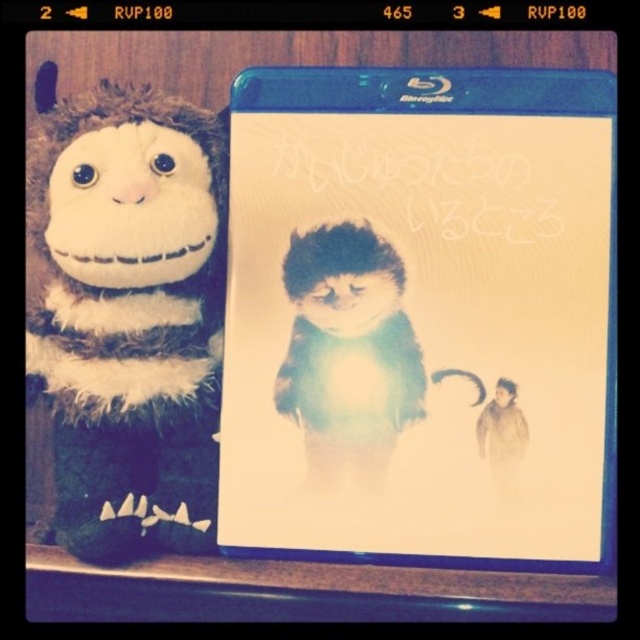
Can you confirm if blue plastic dvd case at center is smaller than fuzzy brown plush monkey at left?

Indeed, blue plastic dvd case at center has a smaller size compared to fuzzy brown plush monkey at left.

Who is more distant from viewer, [451,372] or [61,324]?

Positioned behind is point [451,372].

At what (x,y) coordinates should I click in order to perform the action: click on blue plastic dvd case at center. Please return your answer as a coordinate pair (x, y). The image size is (640, 640). Looking at the image, I should click on (420, 316).